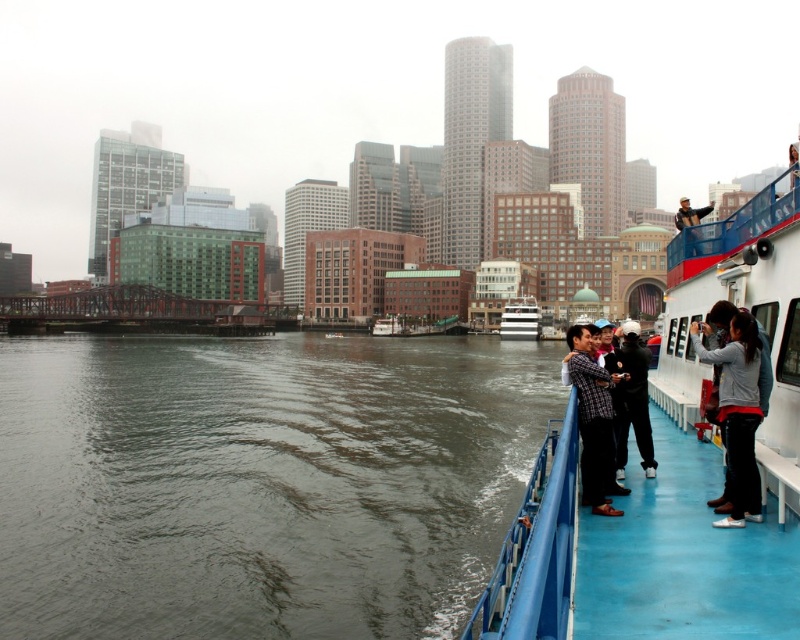
Which is behind, point (728, 424) or point (648, 419)?

Point (648, 419)

Can you confirm if gray fleece jacket at upper right is positioned below dark gray fabric jacket at right?

Correct, gray fleece jacket at upper right is located below dark gray fabric jacket at right.

This screenshot has height=640, width=800. What are the coordinates of `gray fleece jacket at upper right` in the screenshot? It's located at (737, 412).

Is blue plastic rail at right shorter than gray fleece jacket at upper right?

In fact, blue plastic rail at right may be taller than gray fleece jacket at upper right.

Does point (556, 529) come in front of point (740, 422)?

That is True.

Where is `blue plastic rail at right`? The width and height of the screenshot is (800, 640). blue plastic rail at right is located at coordinates (536, 548).

Looking at this image, can you confirm if blue rubber deck at right is positioned above blue plastic rail at right?

Correct, blue rubber deck at right is located above blue plastic rail at right.

Between blue rubber deck at right and blue plastic rail at right, which one appears on the left side from the viewer's perspective?

blue plastic rail at right is more to the left.

Which is in front, point (572, 442) or point (554, 461)?

Positioned in front is point (554, 461).

In order to click on blue rubber deck at right in this screenshot , I will do `click(636, 556)`.